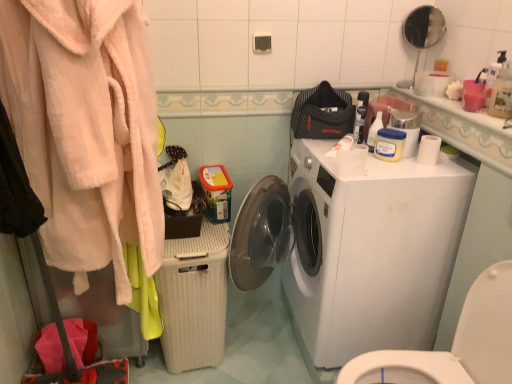
At what (x,y) coordinates should I click in order to perform the action: click on free space in front of white matte toilet paper at upper right. Please return your answer as a coordinate pair (x, y). This screenshot has height=384, width=512. Looking at the image, I should click on (425, 175).